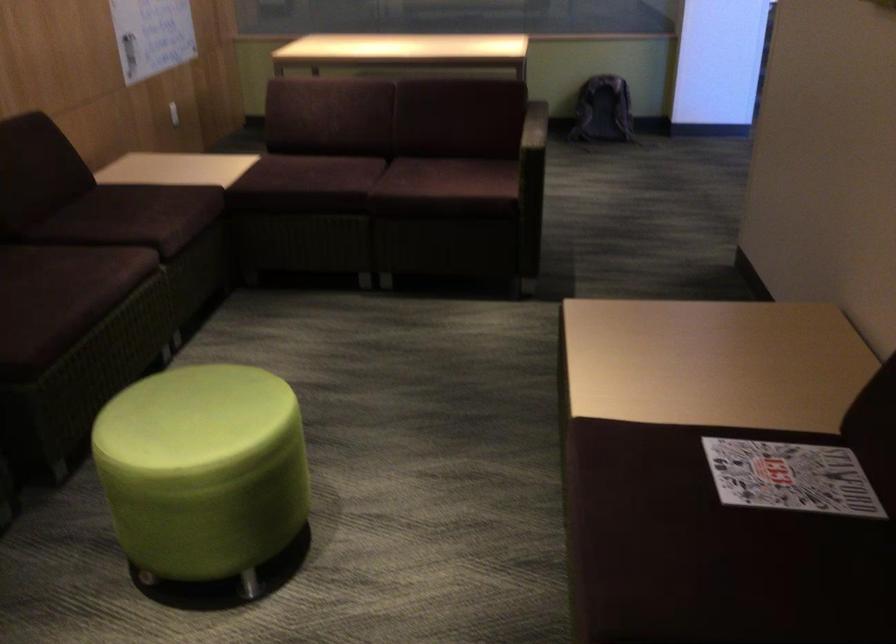
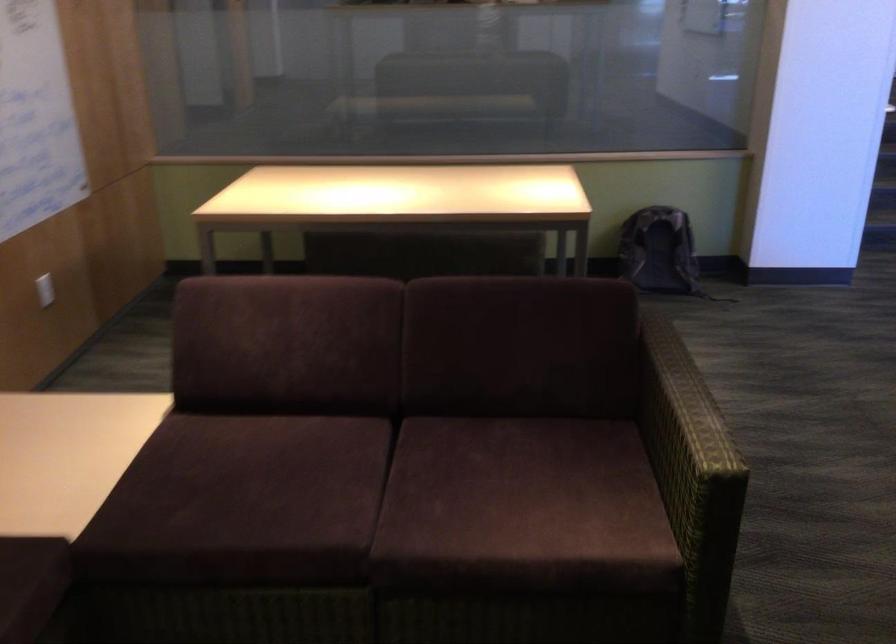
Locate, in the second image, the point that corresponds to (614,95) in the first image.

(660, 252)